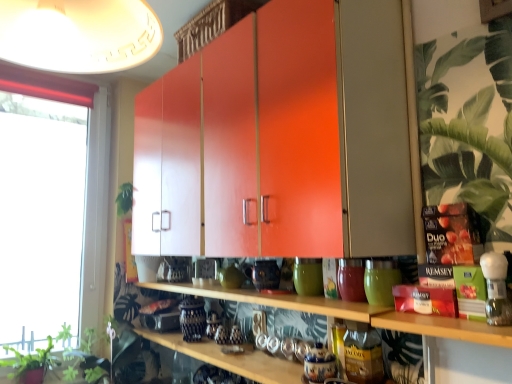
Question: Can you confirm if green matte vase at center, marked as the 3th pottery in a front-to-back arrangement, is positioned to the left of transparent glass window at left?

Choices:
 (A) no
 (B) yes

Answer: (A)

Question: Considering the relative sizes of green matte vase at center, the 3th pottery from the right, and transparent glass window at left in the image provided, is green matte vase at center, the 3th pottery from the right, wider than transparent glass window at left?

Choices:
 (A) no
 (B) yes

Answer: (A)

Question: Can you confirm if green matte vase at center, marked as the 3th pottery in a front-to-back arrangement, is taller than transparent glass window at left?

Choices:
 (A) no
 (B) yes

Answer: (A)

Question: From a real-world perspective, is green matte vase at center, the 3th pottery from the right, positioned over transparent glass window at left based on gravity?

Choices:
 (A) yes
 (B) no

Answer: (B)

Question: Is the position of green matte vase at center, the 3th pottery from the right, less distant than that of transparent glass window at left?

Choices:
 (A) yes
 (B) no

Answer: (A)

Question: Considering their positions, is transparent glass window at left located in front of or behind green matte glass at center, which is the 3th pottery in left-to-right order?

Choices:
 (A) front
 (B) behind

Answer: (B)

Question: From a real-world perspective, is transparent glass window at left physically located above or below green matte glass at center, acting as the 3th pottery starting from the back?

Choices:
 (A) above
 (B) below

Answer: (A)

Question: Is point (12, 228) closer or farther from the camera than point (364, 276)?

Choices:
 (A) closer
 (B) farther

Answer: (B)

Question: From the image's perspective, is transparent glass window at left positioned above or below green matte glass at center, which is the 3th pottery in left-to-right order?

Choices:
 (A) above
 (B) below

Answer: (A)

Question: Choose the correct answer: Is green matte vase at center, marked as the 3th pottery in a front-to-back arrangement, inside wooden shelf at center, the first shelf from the bottom, or outside it?

Choices:
 (A) outside
 (B) inside

Answer: (A)

Question: In terms of width, does green matte vase at center, the 3th pottery from the right, look wider or thinner when compared to wooden shelf at center, positioned as the 2th shelf in top-to-bottom order?

Choices:
 (A) thin
 (B) wide

Answer: (A)

Question: From a real-world perspective, is green matte vase at center, marked as the 3th pottery in a front-to-back arrangement, positioned above or below wooden shelf at center, positioned as the 2th shelf in top-to-bottom order?

Choices:
 (A) below
 (B) above

Answer: (B)

Question: From the image's perspective, is green matte vase at center, marked as the 3th pottery in a front-to-back arrangement, located above or below wooden shelf at center, positioned as the 2th shelf in top-to-bottom order?

Choices:
 (A) above
 (B) below

Answer: (A)

Question: From a real-world perspective, is green leafy plant at lower left, the 2th plant from the back, positioned above or below green matte vase at center, which ranks as the first pottery in left-to-right order?

Choices:
 (A) below
 (B) above

Answer: (A)

Question: Is green leafy plant at lower left, which ranks as the 1th plant in left-to-right order, in front of or behind green matte vase at center, marked as the 3th pottery in a front-to-back arrangement, in the image?

Choices:
 (A) front
 (B) behind

Answer: (B)